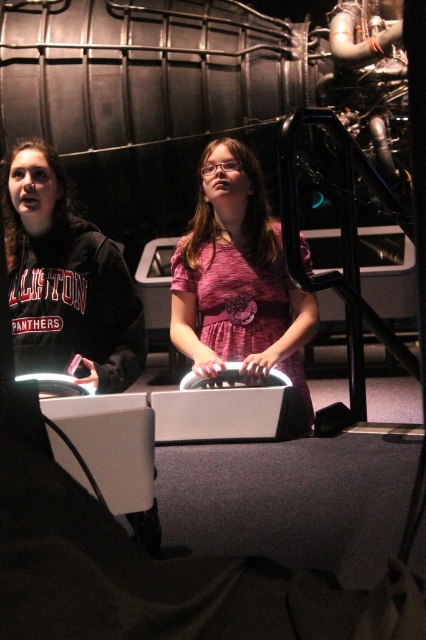
Consider the image. Who is lower down, pink fabric dress at center or matte black hoodie at left?

Positioned lower is pink fabric dress at center.

Can you confirm if pink fabric dress at center is positioned to the right of matte black hoodie at left?

Indeed, pink fabric dress at center is positioned on the right side of matte black hoodie at left.

Where is `pink fabric dress at center`? pink fabric dress at center is located at coordinates (238, 276).